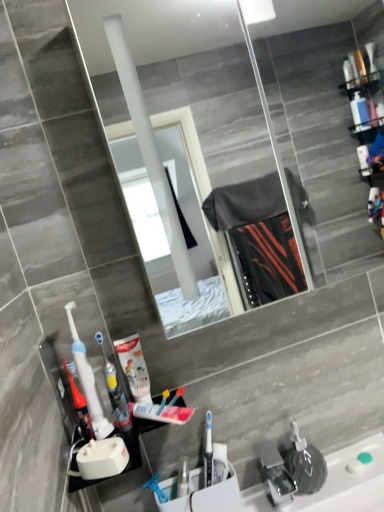
Question: Could you tell me if translucent plastic mouthwash at lower left is facing white glossy toothpaste tube at center?

Choices:
 (A) yes
 (B) no

Answer: (B)

Question: Can white glossy toothpaste tube at center be found inside translucent plastic mouthwash at lower left?

Choices:
 (A) no
 (B) yes

Answer: (A)

Question: Is translucent plastic mouthwash at lower left far away from white glossy toothpaste tube at center?

Choices:
 (A) no
 (B) yes

Answer: (A)

Question: Is translucent plastic mouthwash at lower left bigger than white glossy toothpaste tube at center?

Choices:
 (A) yes
 (B) no

Answer: (B)

Question: Does translucent plastic mouthwash at lower left have a smaller size compared to white glossy toothpaste tube at center?

Choices:
 (A) no
 (B) yes

Answer: (B)

Question: Is translucent plastic mouthwash at lower left to the left of white glossy toothpaste tube at center from the viewer's perspective?

Choices:
 (A) no
 (B) yes

Answer: (B)

Question: Is translucent plastic mouthwash at lower left to the left of white plastic toothbrush holder at lower center, the first sink from the left, from the viewer's perspective?

Choices:
 (A) yes
 (B) no

Answer: (A)

Question: Is translucent plastic mouthwash at lower left thinner than white plastic toothbrush holder at lower center, which is counted as the second sink, starting from the right?

Choices:
 (A) no
 (B) yes

Answer: (B)

Question: Is translucent plastic mouthwash at lower left not within white plastic toothbrush holder at lower center, which is counted as the second sink, starting from the right?

Choices:
 (A) no
 (B) yes

Answer: (B)

Question: Is translucent plastic mouthwash at lower left positioned with its back to white plastic toothbrush holder at lower center, the first sink from the left?

Choices:
 (A) no
 (B) yes

Answer: (A)

Question: From a real-world perspective, is translucent plastic mouthwash at lower left under white plastic toothbrush holder at lower center, the first sink from the left?

Choices:
 (A) no
 (B) yes

Answer: (A)

Question: Does translucent plastic mouthwash at lower left lie behind white plastic toothbrush holder at lower center, which is counted as the second sink, starting from the right?

Choices:
 (A) no
 (B) yes

Answer: (A)

Question: Considering the relative sizes of white plastic toothbrush holder at lower center, which is counted as the second sink, starting from the right, and white glossy toothpaste tube at center in the image provided, is white plastic toothbrush holder at lower center, which is counted as the second sink, starting from the right, wider than white glossy toothpaste tube at center?

Choices:
 (A) no
 (B) yes

Answer: (B)